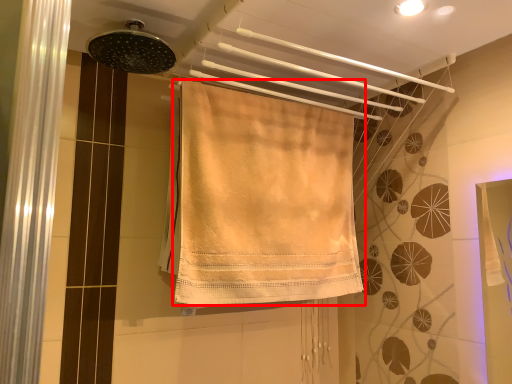
Question: In this image, where is towel (annotated by the red box) located relative to shower?

Choices:
 (A) right
 (B) left

Answer: (A)